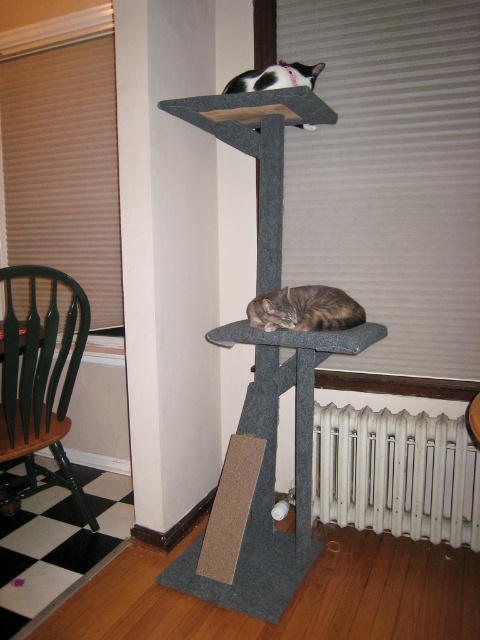
Question: Which point is farther to the camera?

Choices:
 (A) (10, 486)
 (B) (364, 426)
 (C) (296, 67)
 (D) (265, 292)

Answer: (A)

Question: Which object is the closest to the green wood chair at left?

Choices:
 (A) white metal radiator at lower center
 (B) black-and-white fur cat at upper center
 (C) brown fur cat at lower center

Answer: (C)

Question: Does green wood chair at left appear under black-and-white fur cat at upper center?

Choices:
 (A) yes
 (B) no

Answer: (A)

Question: Does white metal radiator at lower center have a smaller size compared to brown fur cat at lower center?

Choices:
 (A) yes
 (B) no

Answer: (B)

Question: Does white metal radiator at lower center come in front of green wood chair at left?

Choices:
 (A) yes
 (B) no

Answer: (B)

Question: Which object is the farthest from the green wood chair at left?

Choices:
 (A) black-and-white fur cat at upper center
 (B) brown fur cat at lower center

Answer: (A)